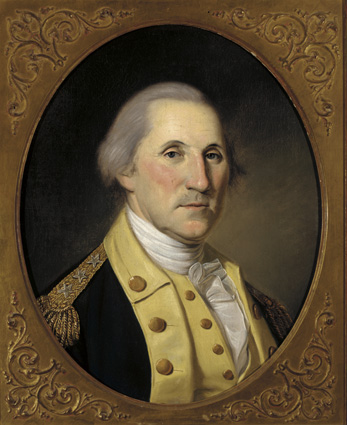
Where is `picture frame`? picture frame is located at coordinates (19, 146).